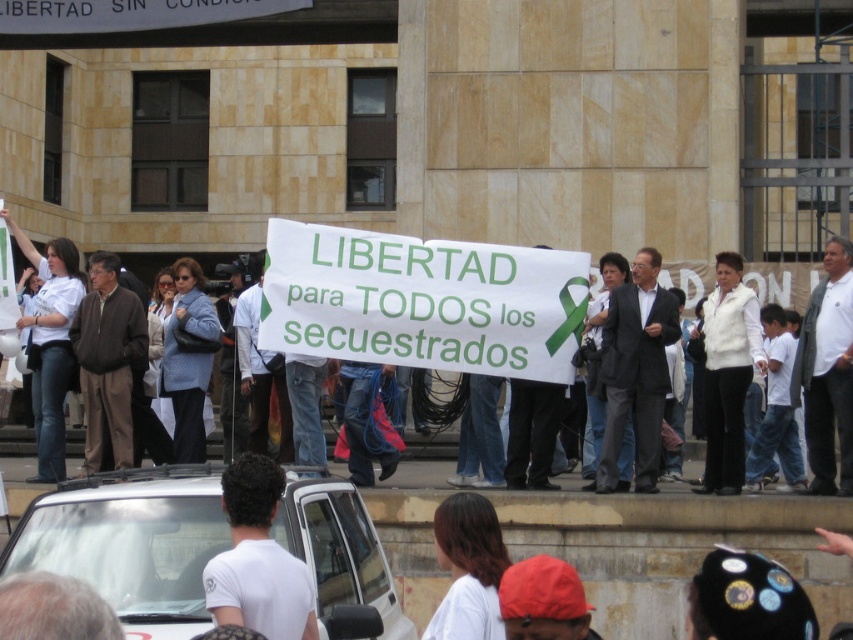
You are a pedestrian standing at the bottom edge of the frame. You want to walk to the white matte car at center. Which direction should you walk to reach it?

Since the white matte car at center is located at point 0.850 on the x axis and 0.154 on the y axis, you should walk towards the upper right direction to reach it.